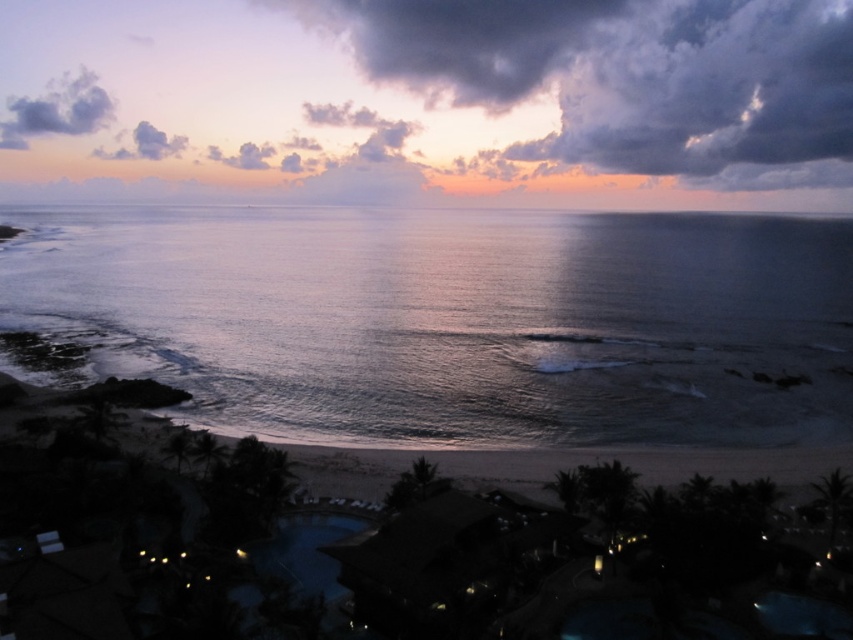
Question: Which object appears farthest from the camera in this image?

Choices:
 (A) shiny blue water at center
 (B) dark gray cloud at upper left
 (C) cloudy sky at upper center

Answer: (B)

Question: Which is nearer to the purple cotton cloud at upper left?

Choices:
 (A) dark gray cloud at upper left
 (B) shiny blue water at center

Answer: (A)

Question: Can you confirm if shiny blue water at center is smaller than purple cotton cloud at upper left?

Choices:
 (A) yes
 (B) no

Answer: (B)

Question: Is cloudy sky at upper center below purple cotton cloud at upper left?

Choices:
 (A) yes
 (B) no

Answer: (B)

Question: Is dark gray cloud at upper left below purple cotton cloud at upper left?

Choices:
 (A) no
 (B) yes

Answer: (A)

Question: Which object appears closest to the camera in this image?

Choices:
 (A) dark gray cloud at upper left
 (B) purple cotton cloud at upper left
 (C) cloudy sky at upper center

Answer: (C)